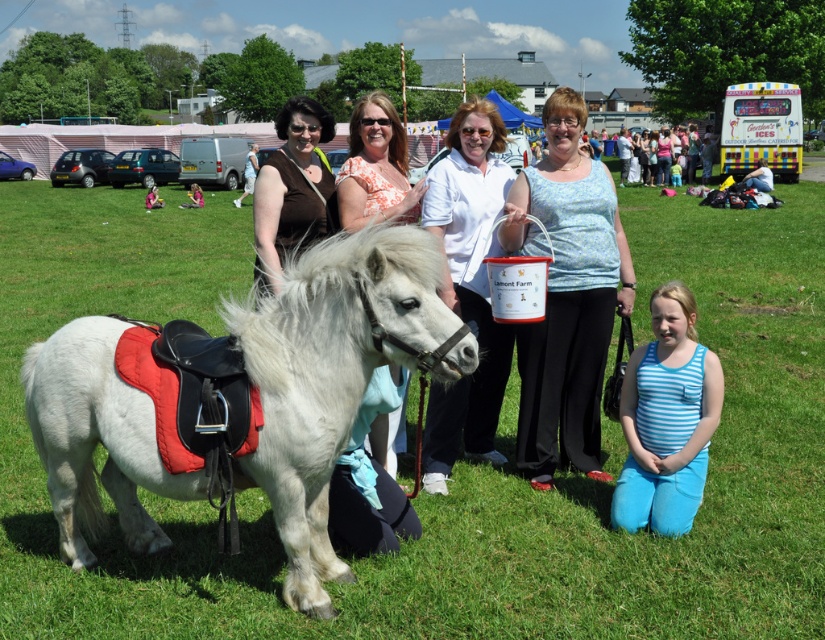
From the picture: Is the position of white matte horse at center more distant than that of white matte shirt at center?

No, white matte horse at center is closer to the viewer.

Does white matte horse at center have a smaller size compared to white matte shirt at center?

Actually, white matte horse at center might be larger than white matte shirt at center.

Between point (368, 284) and point (465, 280), which one is positioned in front?

Point (368, 284) is more forward.

At what (x,y) coordinates should I click in order to perform the action: click on white matte horse at center. Please return your answer as a coordinate pair (x, y). Looking at the image, I should click on (335, 374).

Does green grass at center have a larger size compared to blue striped tank top at lower right?

Yes.

Which is above, green grass at center or blue striped tank top at lower right?

green grass at center

Who is more forward, (797, 544) or (663, 401)?

Positioned in front is point (797, 544).

This screenshot has height=640, width=825. What are the coordinates of `green grass at center` in the screenshot? It's located at coord(456,461).

Which of these two, white matte shirt at center or orange floral blouse at center, stands taller?

Standing taller between the two is orange floral blouse at center.

Does point (439, 449) come in front of point (392, 150)?

That is True.

You are a GUI agent. You are given a task and a screenshot of the screen. Output one action in this format:
    pyautogui.click(x=<x>, y=<y>)
    Task: Click on the white matte shirt at center
    This screenshot has height=640, width=825.
    Given the screenshot: What is the action you would take?
    pyautogui.click(x=467, y=288)